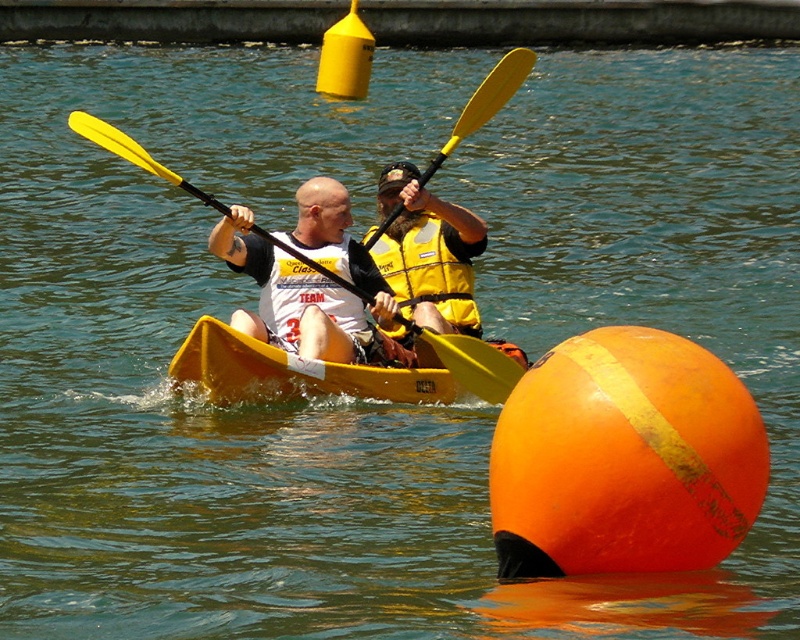
You are a photographer taking a picture of the white matte shirt at center and the yellow matte life jacket at center. Which one should you focus on first if you want to capture both in the same frame?

The white matte shirt at center is to the left of the yellow matte life jacket at center, so you should focus on the white matte shirt at center first to ensure both are in frame.

You are a photographer standing on the dock, and you want to take a photo of the white matte shirt at center and the yellow matte life jacket at center so that both are clearly visible in the frame. Given that your camera has a minimum focus distance of 5 feet, will you be able to capture both objects in focus without moving closer?

The white matte shirt at center and yellow matte life jacket at center are 5.52 feet apart. Since the distance between them is greater than the camera minimum focus distance of 5 feet, the photographer can capture both objects in focus without moving closer.

You are a photographer positioned at the origin point of the image coordinate system. You need to capture a closeup shot of the white matte shirt at center. According to the coordinates provided, in which direction should you move your camera to focus on the shirt?

The white matte shirt at center is located at point [297,300]. Since the origin is at the bottom left corner, moving the camera to the right and slightly upwards from the origin will position it to focus on the shirt.